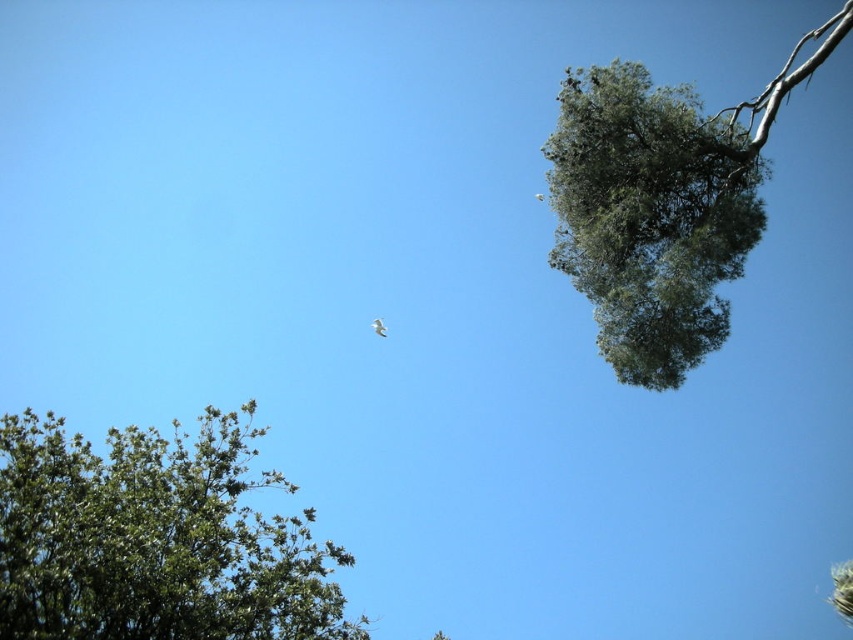
Who is more distant from viewer, (22, 548) or (374, 321)?

The point (374, 321) is more distant.

Measure the distance between point (39, 460) and camera.

A distance of 16.80 meters exists between point (39, 460) and camera.

What do you see at coordinates (154, 540) in the screenshot? I see `green leafy tree at lower left` at bounding box center [154, 540].

You are a GUI agent. You are given a task and a screenshot of the screen. Output one action in this format:
    pyautogui.click(x=<x>, y=<y>)
    Task: Click on the green leafy tree at lower left
    
    Given the screenshot: What is the action you would take?
    pyautogui.click(x=154, y=540)

Consider the image. Can you confirm if green leafy olive tree at upper right is positioned to the left of white feathered bird at center?

Incorrect, green leafy olive tree at upper right is not on the left side of white feathered bird at center.

Does green leafy olive tree at upper right have a larger size compared to white feathered bird at center?

No, green leafy olive tree at upper right is not bigger than white feathered bird at center.

Where is `green leafy olive tree at upper right`? The image size is (853, 640). green leafy olive tree at upper right is located at coordinates (648, 218).

Identify the location of white feathered bird at center. The height and width of the screenshot is (640, 853). (379, 326).

Can you confirm if white feathered bird at center is taller than white feathered bird at upper center?

Indeed, white feathered bird at center has a greater height compared to white feathered bird at upper center.

Is point (373, 330) farther from viewer compared to point (535, 196)?

That is False.

The image size is (853, 640). I want to click on white feathered bird at center, so click(379, 326).